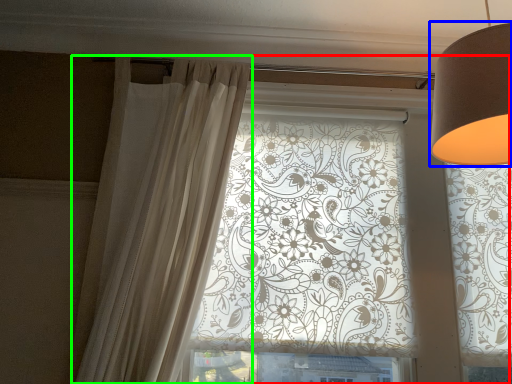
Question: Which object is the farthest from window (highlighted by a red box)? Choose among these: lamp (highlighted by a blue box) or curtain (highlighted by a green box).

Choices:
 (A) lamp
 (B) curtain

Answer: (A)